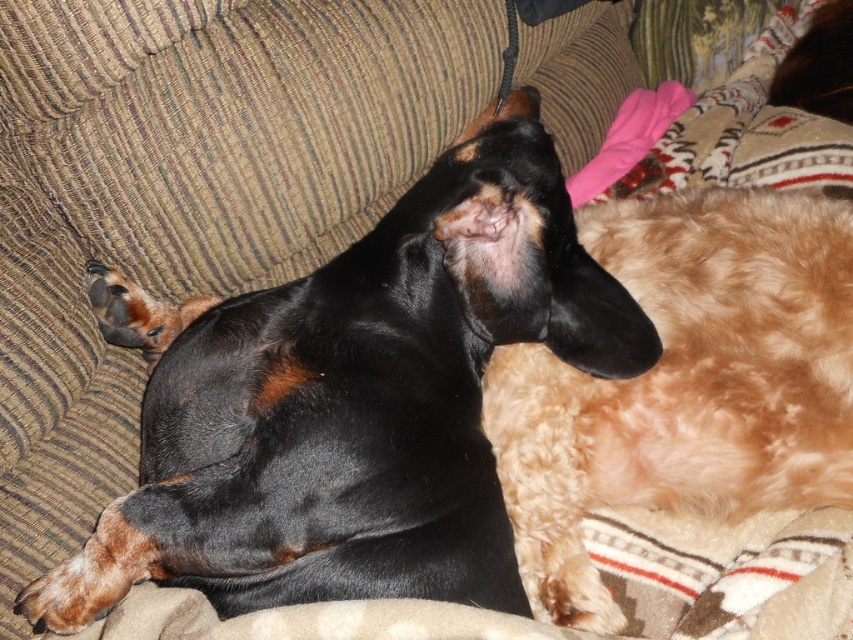
You are a pet sitter observing two dogs on the couch. You need to place a small toy between them so both can reach it easily. Given their positions, where should you place the toy relative to the black smooth dog at center and the fuzzy brown dog at upper right?

The black smooth dog at center is positioned over the fuzzy brown dog at upper right, so placing the toy between them would require positioning it below the black smooth dog at center and above the fuzzy brown dog at upper right to ensure both can reach it.

You are a dog trainer assessing the space between two dogs on a couch. The black smooth dog at center and the fuzzy brown dog at upper right. Can you determine which dog is wider?

The black smooth dog at center is wider than the fuzzy brown dog at upper right according to the description.